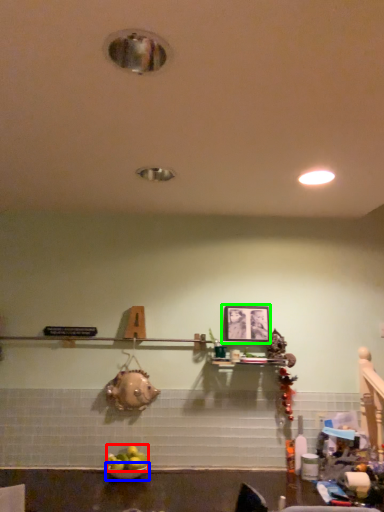
Question: Considering the real-world distances, which object is farthest from fruit (highlighted by a red box)? bowl (highlighted by a blue box) or picture frame (highlighted by a green box)?

Choices:
 (A) bowl
 (B) picture frame

Answer: (B)